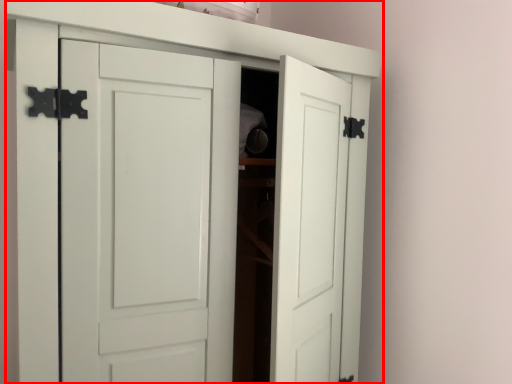
Question: In this image, where is cupboard (annotated by the red box) located relative to shelf?

Choices:
 (A) left
 (B) right

Answer: (A)